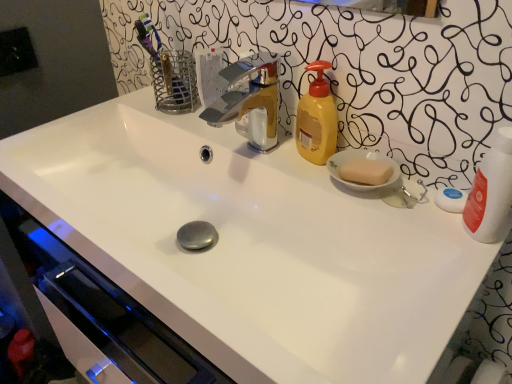
Where is `vacant area located to the right-hand side of polished chrome faucet at center`? This screenshot has width=512, height=384. vacant area located to the right-hand side of polished chrome faucet at center is located at coordinates pyautogui.click(x=307, y=164).